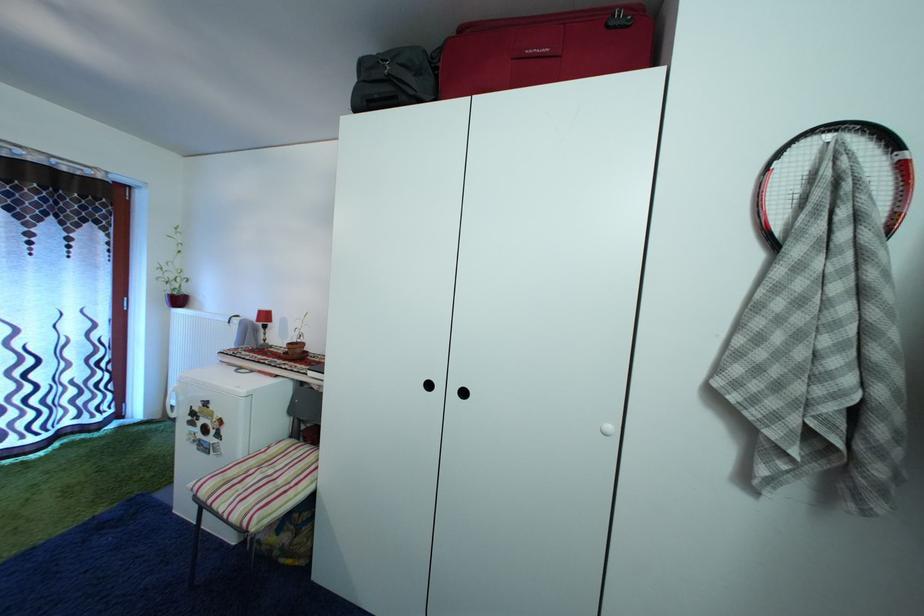
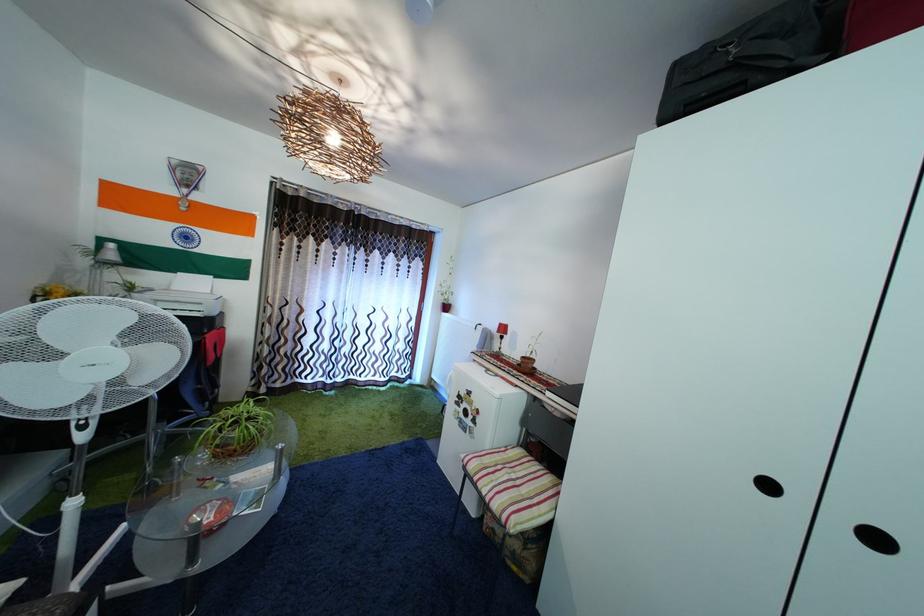
Where in the second image is the point corresponding to pixel 402 63 from the first image?

(754, 38)